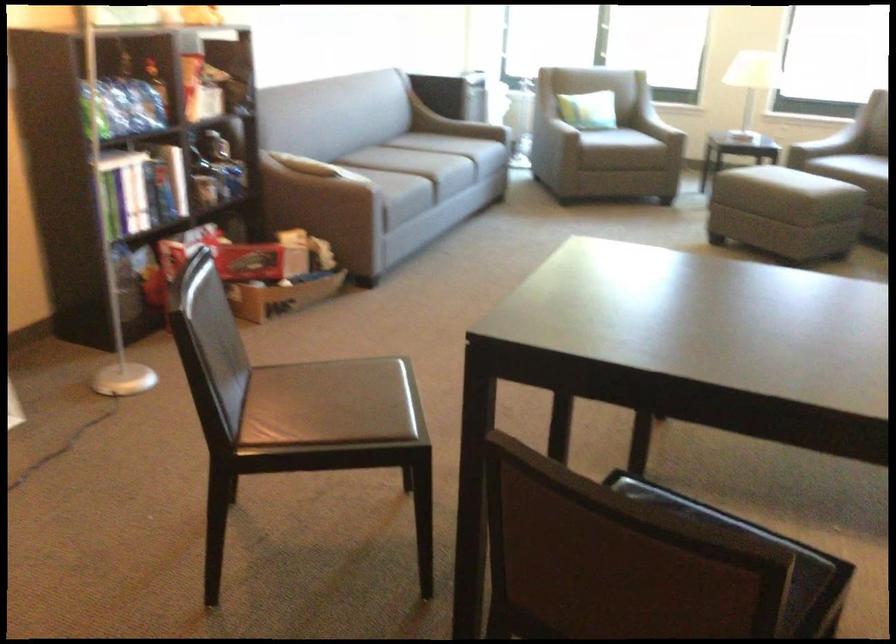
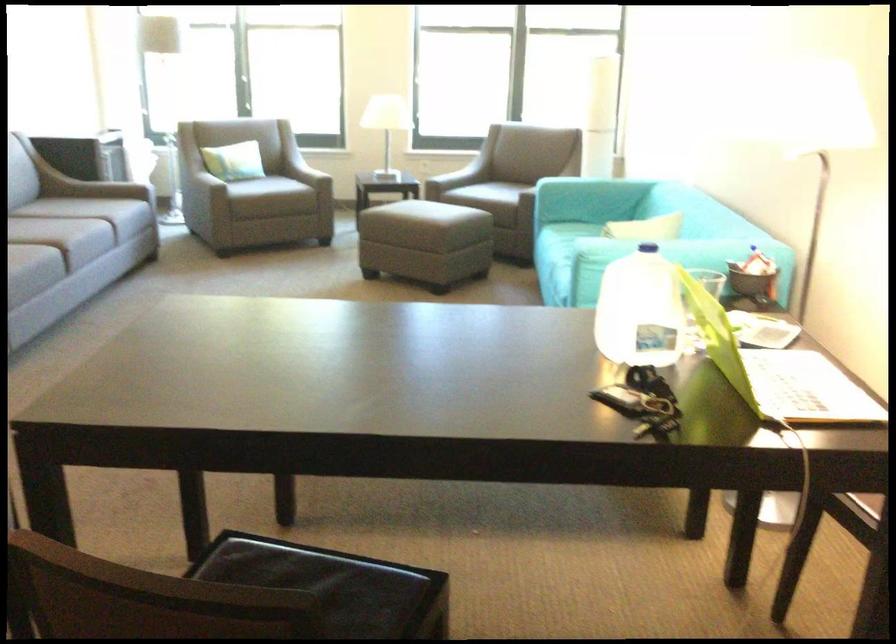
Question: The images are taken continuously from a first-person perspective. In which direction are you moving?

Choices:
 (A) Left
 (B) Right
 (C) Forward
 (D) Backward

Answer: (D)